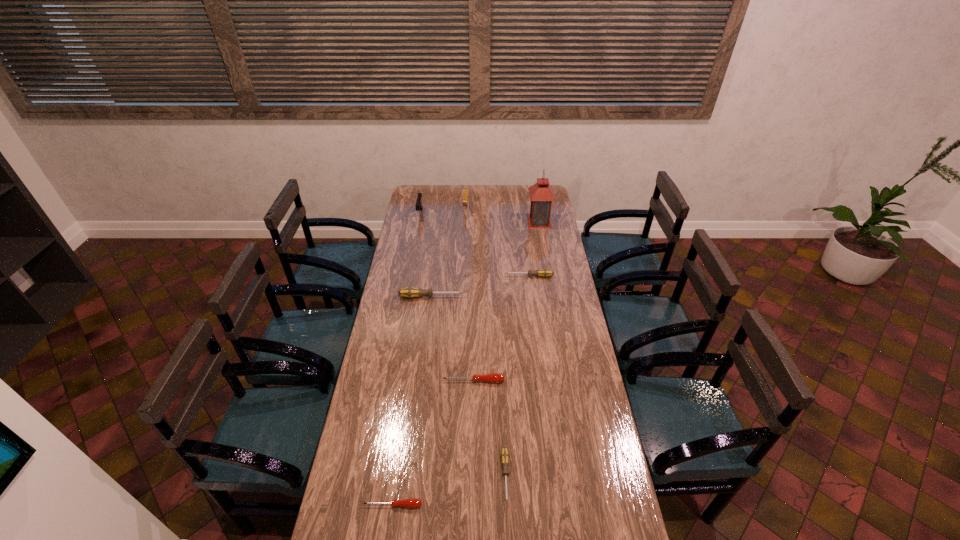
Locate an element on the screen. The image size is (960, 540). the nearest gray screwdriver is located at coordinates (504, 456).

The height and width of the screenshot is (540, 960). I want to click on the second gray screwdriver from right to left, so click(504, 456).

Identify the location of the shortest screwdriver. The image size is (960, 540). (411, 502).

Image resolution: width=960 pixels, height=540 pixels. Identify the location of the shortest object. (411, 502).

Locate an element on the screen. The height and width of the screenshot is (540, 960). vacant position located 0.210m on the left of the pink lantern is located at coordinates (491, 222).

Identify the location of vacant space located 0.170m on the front-facing side of the left pistol. The image size is (960, 540). (416, 240).

You are a GUI agent. You are given a task and a screenshot of the screen. Output one action in this format:
    pyautogui.click(x=<x>, y=<y>)
    Task: Click on the blank area located 0.250m at the barrel of the tan pistol
    
    Given the screenshot: What is the action you would take?
    pyautogui.click(x=464, y=243)

The height and width of the screenshot is (540, 960). Find the location of `free spot located 0.310m at the tip of the tallest screwdriver`. free spot located 0.310m at the tip of the tallest screwdriver is located at coordinates (529, 297).

Find the location of a particular element. The width and height of the screenshot is (960, 540). free space located 0.130m at the tip of the farthest screwdriver is located at coordinates (478, 276).

The image size is (960, 540). Identify the location of vacant region located at the tip of the farthest screwdriver. (456, 276).